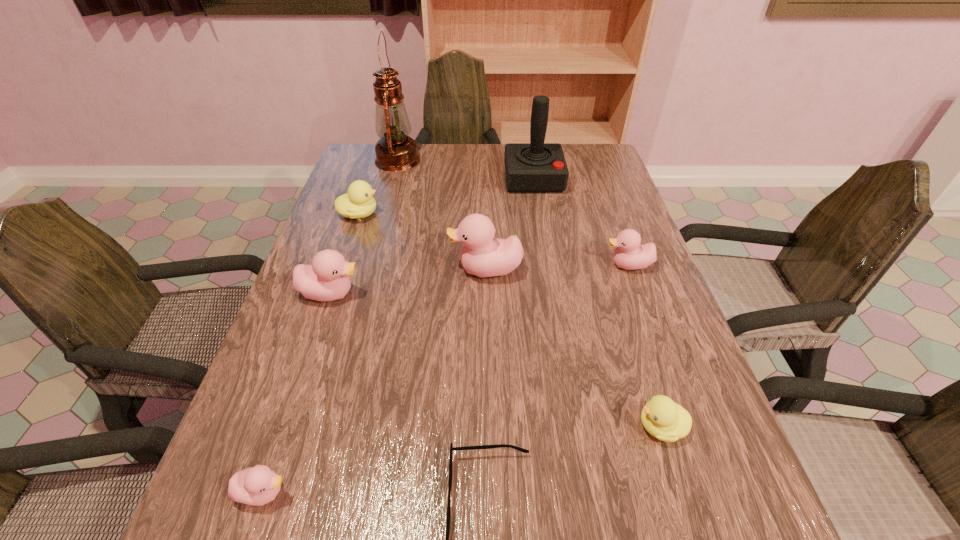
This screenshot has width=960, height=540. Find the location of `free space located 0.190m at the beak of the farthest duckling`. free space located 0.190m at the beak of the farthest duckling is located at coordinates (447, 214).

This screenshot has width=960, height=540. I want to click on free space located 0.240m on the front-facing side of the rightmost pink duckling, so click(507, 265).

Identify the location of vacant region located on the front-facing side of the rightmost pink duckling. (491, 265).

At what (x,y) coordinates should I click in order to perform the action: click on blank space located on the front-facing side of the rightmost pink duckling. Please return your answer as a coordinate pair (x, y). This screenshot has height=540, width=960. Looking at the image, I should click on (551, 265).

The width and height of the screenshot is (960, 540). What are the coordinates of `free space located 0.330m at the beak of the right yellow duckling` in the screenshot? It's located at (450, 427).

The height and width of the screenshot is (540, 960). Find the location of `vacant space located 0.370m at the beak of the right yellow duckling`. vacant space located 0.370m at the beak of the right yellow duckling is located at coordinates (428, 427).

Identify the location of vacant space located 0.230m at the beak of the right yellow duckling. This screenshot has width=960, height=540. (507, 427).

At what (x,y) coordinates should I click in order to perform the action: click on free space located 0.370m on the front-facing side of the nearest duckling. Please return your answer as a coordinate pair (x, y). The height and width of the screenshot is (540, 960). Looking at the image, I should click on (524, 492).

You are a GUI agent. You are given a task and a screenshot of the screen. Output one action in this format:
    pyautogui.click(x=<x>, y=<y>)
    Task: Click on the oil lamp that is at the far edge
    
    Given the screenshot: What is the action you would take?
    pyautogui.click(x=395, y=151)

The width and height of the screenshot is (960, 540). What are the coordinates of `joystick present at the far edge` in the screenshot? It's located at (536, 167).